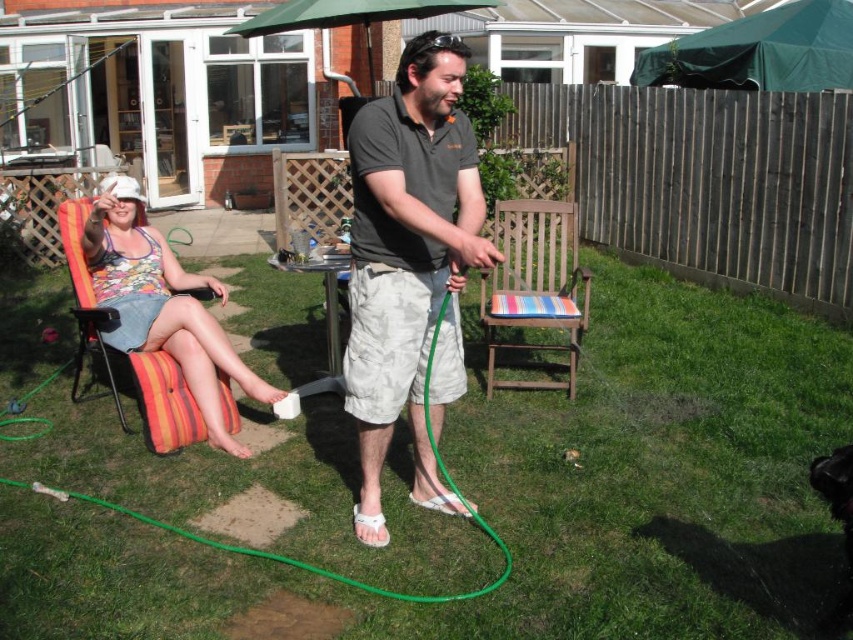
Which is below, dark gray cotton shirt at center or green rubber hose at lower left?

green rubber hose at lower left is below.

Does point (373, 460) come in front of point (28, 420)?

Yes, point (373, 460) is in front of point (28, 420).

Which is behind, point (410, 493) or point (120, 403)?

Positioned behind is point (120, 403).

Identify the location of dark gray cotton shirt at center. The height and width of the screenshot is (640, 853). (x=409, y=264).

Looking at this image, can you confirm if striped fabric chair at left is taller than green rubber hose at lower left?

Correct, striped fabric chair at left is much taller as green rubber hose at lower left.

Who is higher up, striped fabric chair at left or green rubber hose at lower left?

striped fabric chair at left

Who is more forward, (196, 417) or (397, 595)?

Point (397, 595)

This screenshot has height=640, width=853. Find the location of `striped fabric chair at left`. striped fabric chair at left is located at coordinates (166, 403).

Which of these two, striped fabric chair at center or striped fabric chair at left, stands shorter?

Standing shorter between the two is striped fabric chair at center.

Is striped fabric chair at center above striped fabric chair at left?

Indeed, striped fabric chair at center is positioned over striped fabric chair at left.

Identify the location of striped fabric chair at center. (535, 285).